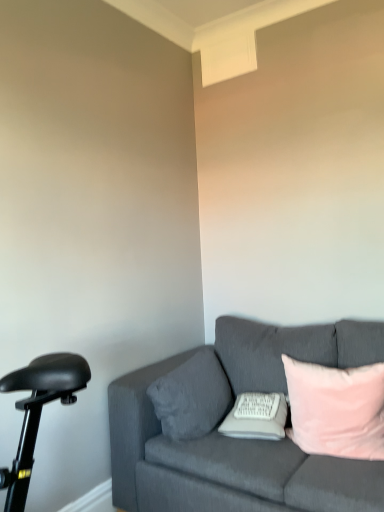
Question: From the image's perspective, is white soft pillow at center, the 2th pillow viewed from the right, above or below pink velvet pillow at right, the 1th pillow when ordered from right to left?

Choices:
 (A) below
 (B) above

Answer: (A)

Question: In the image, is white soft pillow at center, the 2th pillow viewed from the right, on the left side or the right side of pink velvet pillow at right, the 1th pillow when ordered from right to left?

Choices:
 (A) left
 (B) right

Answer: (A)

Question: Which is farther from the pink velvet pillow at right, which ranks as the third pillow in left-to-right order?

Choices:
 (A) velvet gray pillow at center, the third pillow positioned from the right
 (B) white soft pillow at center, which ranks as the 2th pillow in left-to-right order
 (C) velvet gray couch at right

Answer: (A)

Question: Which of these objects is positioned closest to the velvet gray pillow at center, positioned as the 1th pillow in left-to-right order?

Choices:
 (A) white soft pillow at center, the 2th pillow viewed from the right
 (B) velvet gray couch at right
 (C) pink velvet pillow at right, which ranks as the third pillow in left-to-right order

Answer: (B)